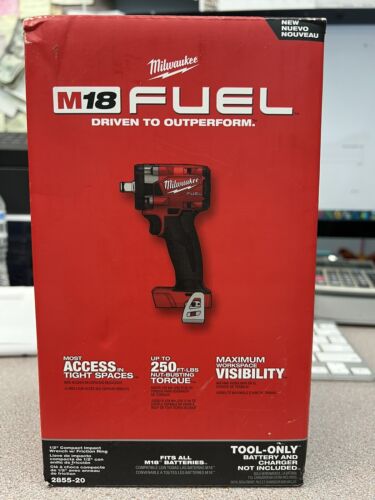
Image resolution: width=375 pixels, height=500 pixels. Find the location of `calculator in left side background`. calculator in left side background is located at coordinates (345, 274).